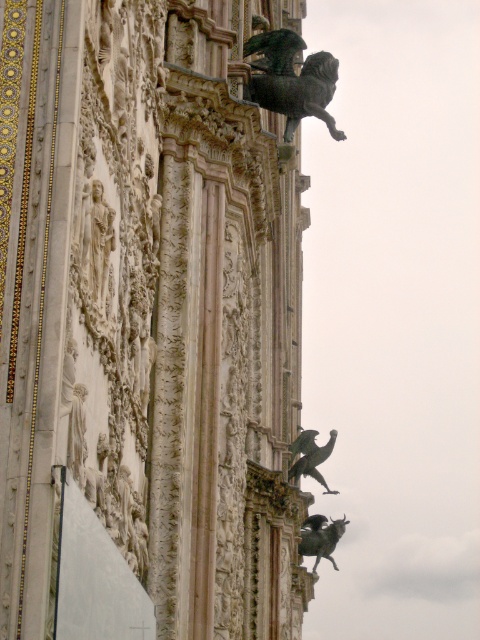
You are an architect assessing the facade for maintenance. You notice the shiny bronze gargoyle at upper right and the shiny bronze bird at upper center. Which of these two objects is taller?

The shiny bronze gargoyle at upper right is taller than the shiny bronze bird at upper center.